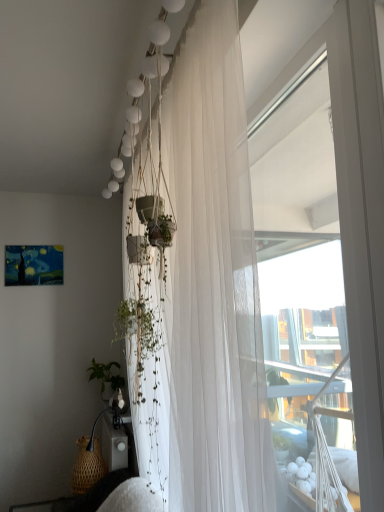
Question: Considering the positions of point (147, 367) and point (87, 466), is point (147, 367) closer or farther from the camera than point (87, 466)?

Choices:
 (A) closer
 (B) farther

Answer: (A)

Question: From a real-world perspective, is white sheer curtain at upper center positioned above or below woven brown basket at lower left?

Choices:
 (A) above
 (B) below

Answer: (A)

Question: Based on their sizes in the image, would you say white sheer curtain at upper center is bigger or smaller than woven brown basket at lower left?

Choices:
 (A) big
 (B) small

Answer: (A)

Question: Is woven brown basket at lower left inside or outside of white sheer curtain at upper center?

Choices:
 (A) inside
 (B) outside

Answer: (B)

Question: Considering the positions of point (89, 474) and point (258, 455), is point (89, 474) closer or farther from the camera than point (258, 455)?

Choices:
 (A) farther
 (B) closer

Answer: (A)

Question: Is woven brown basket at lower left wider or thinner than white sheer curtain at upper center?

Choices:
 (A) wide
 (B) thin

Answer: (B)

Question: From a real-world perspective, relative to white sheer curtain at upper center, is woven brown basket at lower left vertically above or below?

Choices:
 (A) above
 (B) below

Answer: (B)